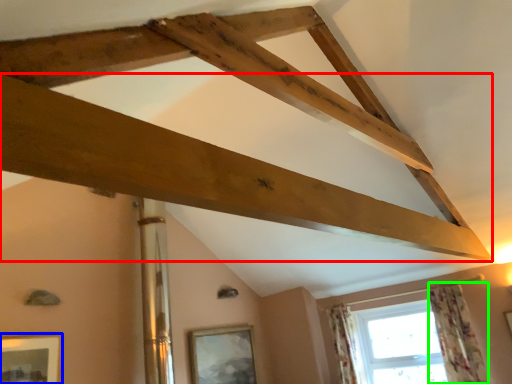
Question: Which object is the farthest from plank (highlighted by a red box)? Choose among these: picture frame (highlighted by a blue box) or curtain (highlighted by a green box).

Choices:
 (A) picture frame
 (B) curtain

Answer: (A)